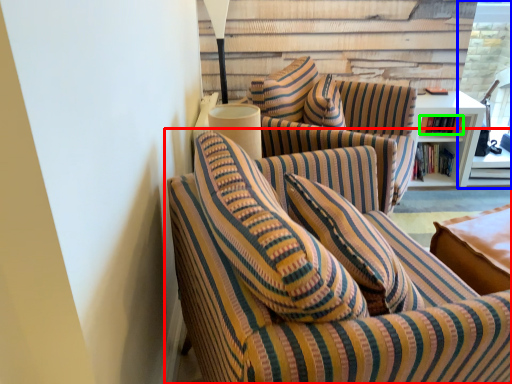
Question: Which is nearer to the studio couch (highlighted by a red box)? glass door (highlighted by a blue box) or book (highlighted by a green box).

Choices:
 (A) glass door
 (B) book

Answer: (B)